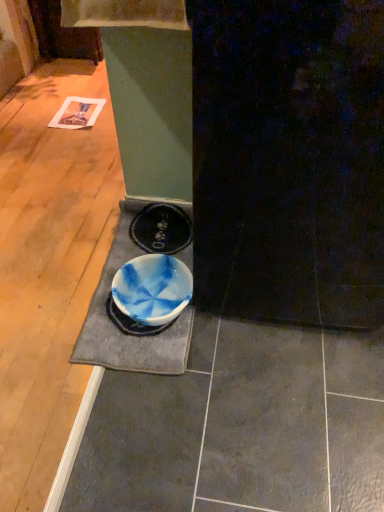
Question: Considering the relative positions of blue marbled bowl at center and blue marbled doormat at center in the image provided, is blue marbled bowl at center to the right of blue marbled doormat at center from the viewer's perspective?

Choices:
 (A) yes
 (B) no

Answer: (A)

Question: Is blue marbled bowl at center positioned with its back to blue marbled doormat at center?

Choices:
 (A) yes
 (B) no

Answer: (A)

Question: Is blue marbled bowl at center behind blue marbled doormat at center?

Choices:
 (A) no
 (B) yes

Answer: (B)

Question: Is blue marbled bowl at center wider than blue marbled doormat at center?

Choices:
 (A) yes
 (B) no

Answer: (B)

Question: Is blue marbled bowl at center at the left side of blue marbled doormat at center?

Choices:
 (A) yes
 (B) no

Answer: (B)

Question: From a real-world perspective, is blue marbled bowl at center located higher than blue marbled doormat at center?

Choices:
 (A) yes
 (B) no

Answer: (A)

Question: Is blue marbled doormat at center further to camera compared to blue marbled bowl at center?

Choices:
 (A) yes
 (B) no

Answer: (B)

Question: Could you tell me if blue marbled doormat at center is facing blue marbled bowl at center?

Choices:
 (A) yes
 (B) no

Answer: (A)

Question: Considering the relative positions of blue marbled doormat at center and blue marbled bowl at center in the image provided, is blue marbled doormat at center in front of blue marbled bowl at center?

Choices:
 (A) yes
 (B) no

Answer: (A)

Question: Is blue marbled doormat at center turned away from blue marbled bowl at center?

Choices:
 (A) no
 (B) yes

Answer: (B)

Question: From the image's perspective, is blue marbled doormat at center located beneath blue marbled bowl at center?

Choices:
 (A) no
 (B) yes

Answer: (A)

Question: From a real-world perspective, is blue marbled doormat at center below blue marbled bowl at center?

Choices:
 (A) no
 (B) yes

Answer: (B)

Question: From the image's perspective, is blue marbled bowl at center located above or below blue marbled doormat at center?

Choices:
 (A) above
 (B) below

Answer: (B)